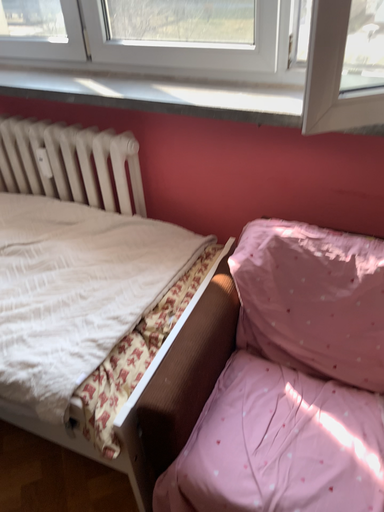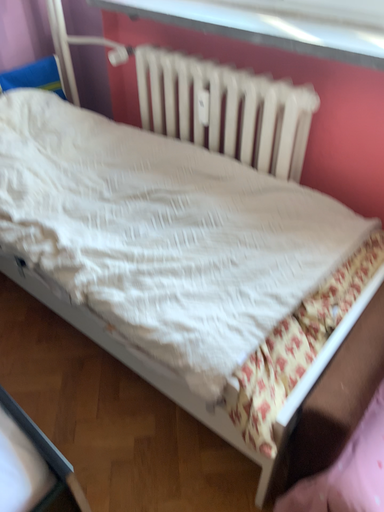
Question: Which way did the camera rotate in the video?

Choices:
 (A) rotated left
 (B) rotated right

Answer: (A)